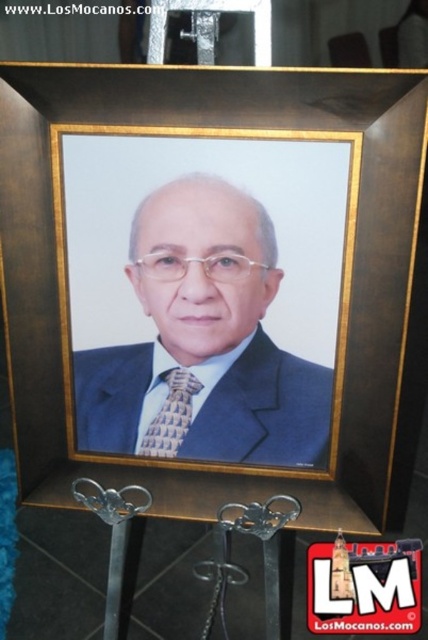
Does matte black suit at center appear on the right side of matte blue suit at center?

Incorrect, matte black suit at center is not on the right side of matte blue suit at center.

Who is more forward, (x=157, y=356) or (x=318, y=371)?

Positioned in front is point (x=318, y=371).

Is point (121, 403) closer to viewer compared to point (143, 372)?

That is False.

Find the location of a particular element. This screenshot has width=428, height=640. matte black suit at center is located at coordinates pos(202,342).

Is brown wooden picture frame at center shorter than matte black suit at center?

Incorrect, brown wooden picture frame at center's height does not fall short of matte black suit at center's.

Does brown wooden picture frame at center appear on the left side of matte black suit at center?

Incorrect, brown wooden picture frame at center is not on the left side of matte black suit at center.

The height and width of the screenshot is (640, 428). Describe the element at coordinates (350, 282) in the screenshot. I see `brown wooden picture frame at center` at that location.

I want to click on brown wooden picture frame at center, so click(350, 282).

Is matte blue suit at center smaller than gold textured tie at center?

No, matte blue suit at center is not smaller than gold textured tie at center.

Can you confirm if matte blue suit at center is wider than gold textured tie at center?

Indeed, matte blue suit at center has a greater width compared to gold textured tie at center.

Locate an element on the screen. This screenshot has height=640, width=428. matte blue suit at center is located at coordinates (264, 410).